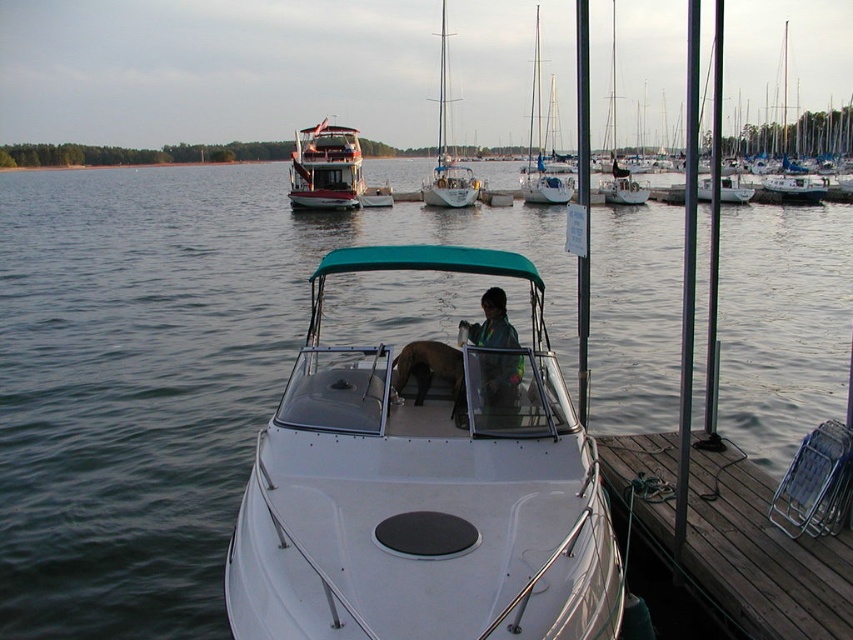
Question: Estimate the real-world distances between objects in this image. Which object is farther from the green fabric jacket at center?

Choices:
 (A) brown fur dog at center
 (B) white glossy houseboat at upper center
 (C) white sailboat at upper center
 (D) white sailboat at center

Answer: (C)

Question: Estimate the real-world distances between objects in this image. Which object is closer to the white glossy houseboat at upper center?

Choices:
 (A) white sailboat at center
 (B) green fabric jacket at center

Answer: (B)

Question: Considering the real-world distances, which object is closest to the white glossy houseboat at upper center?

Choices:
 (A) white sailboat at center
 (B) brown wooden dock at lower right
 (C) brown fur dog at center
 (D) white glossy boat at center

Answer: (C)

Question: Is the position of white glossy houseboat at upper center less distant than that of white glossy sailboat at upper right?

Choices:
 (A) no
 (B) yes

Answer: (B)

Question: Where is brown wooden dock at lower right located in relation to white sailboat at upper center in the image?

Choices:
 (A) left
 (B) right

Answer: (A)

Question: Is white glossy houseboat at upper center wider than green fabric jacket at center?

Choices:
 (A) yes
 (B) no

Answer: (A)